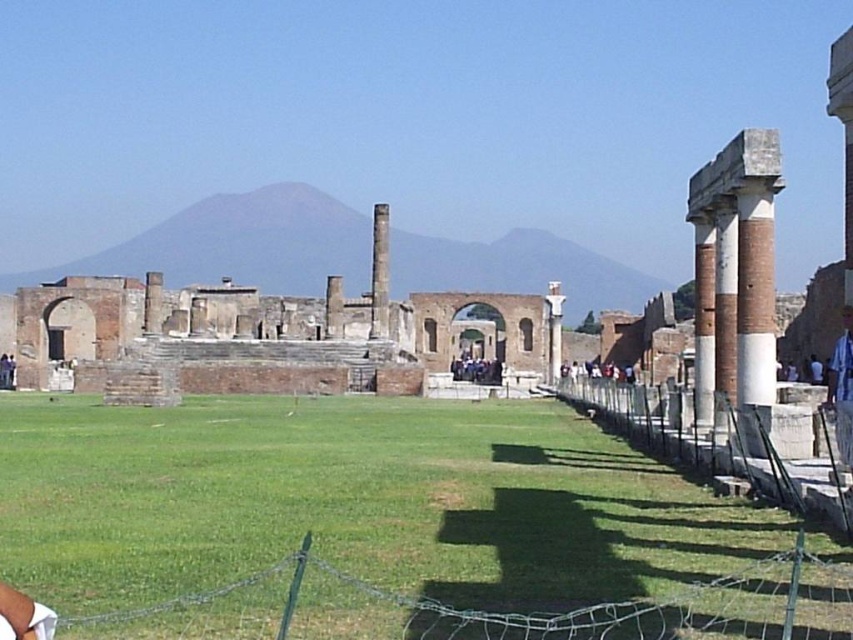
Question: Which point is farther to the camera?

Choices:
 (A) (384, 324)
 (B) (273, 625)
 (C) (747, 291)
 (D) (848, 428)

Answer: (A)

Question: Can you confirm if green wire mesh at lower center is positioned to the left of light blue fabric shirt at right?

Choices:
 (A) no
 (B) yes

Answer: (B)

Question: Is white stone fence at right above light blue fabric shirt at right?

Choices:
 (A) yes
 (B) no

Answer: (B)

Question: Which object is positioned farthest from the light blue fabric shirt at right?

Choices:
 (A) dark gray stone people at center
 (B) red brick column at right

Answer: (A)

Question: Considering the real-world distances, which object is farthest from the red brick column at right?

Choices:
 (A) green wire mesh at lower center
 (B) light blue fabric shirt at right
 (C) smooth stone pillar at center
 (D) white stone fence at right

Answer: (C)

Question: Can you confirm if green wire mesh at lower center is smaller than red brick column at right?

Choices:
 (A) no
 (B) yes

Answer: (B)